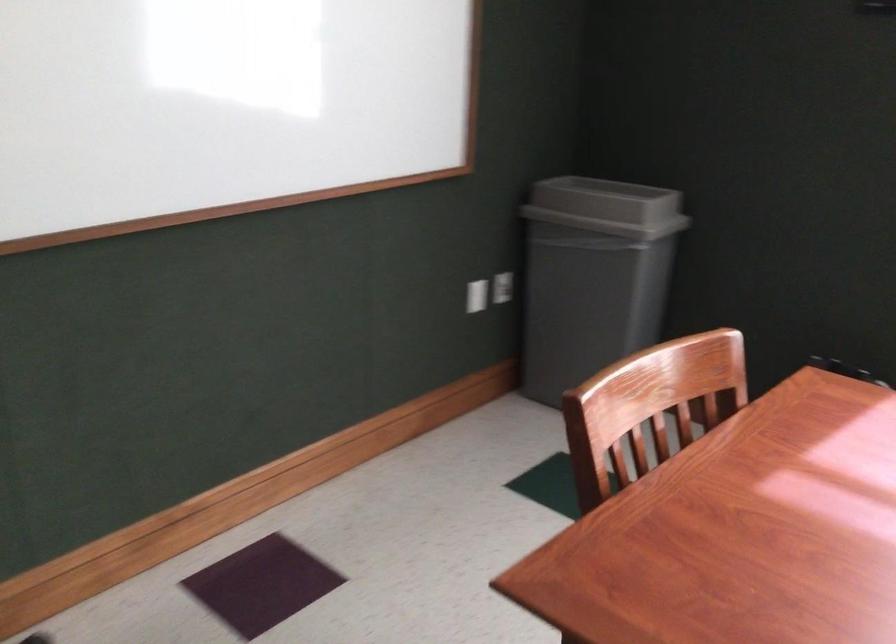
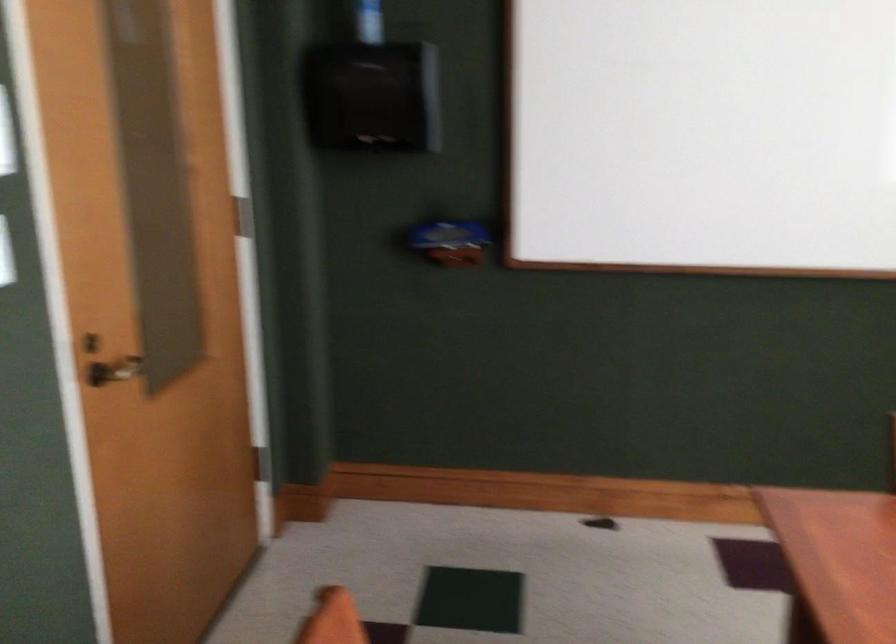
Question: The images are taken continuously from a first-person perspective. In which direction is your viewpoint rotating?

Choices:
 (A) Left
 (B) Right
 (C) Up
 (D) Down

Answer: (A)